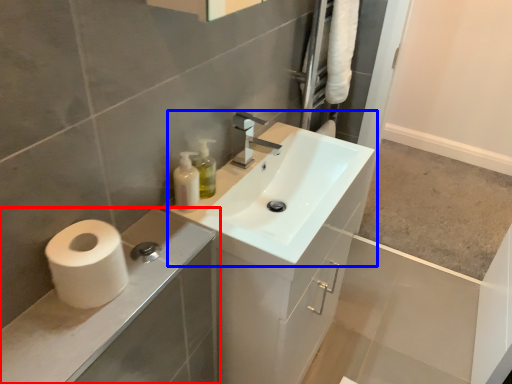
Question: Which point is closer to the camera, bathroom cabinet (highlighted by a red box) or sink (highlighted by a blue box)?

Choices:
 (A) bathroom cabinet
 (B) sink

Answer: (A)